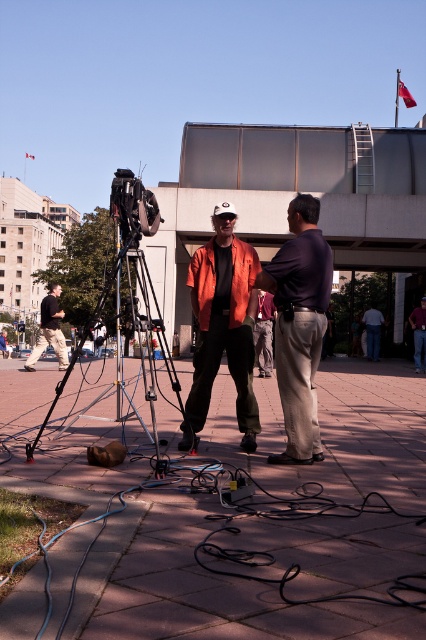
Question: Which object appears closest to the camera in this image?

Choices:
 (A) denim jeans at lower right
 (B) black shirt at left
 (C) velvet brown pants at center

Answer: (C)

Question: Does brown concrete pavement at center lie behind denim jeans at lower right?

Choices:
 (A) no
 (B) yes

Answer: (A)

Question: In this image, where is brown concrete pavement at center located relative to matte black video camera at left?

Choices:
 (A) left
 (B) right

Answer: (B)

Question: From the image, what is the correct spatial relationship of orange matte shirt at center in relation to black shirt at left?

Choices:
 (A) above
 (B) below

Answer: (B)

Question: Among these points, which one is farthest from the camera?

Choices:
 (A) (305, 300)
 (B) (267, 300)
 (C) (416, 362)
 (D) (40, 353)

Answer: (C)

Question: Among these objects, which one is nearest to the camera?

Choices:
 (A) orange matte shirt at center
 (B) velvet brown pants at center
 (C) brown concrete pavement at center

Answer: (C)